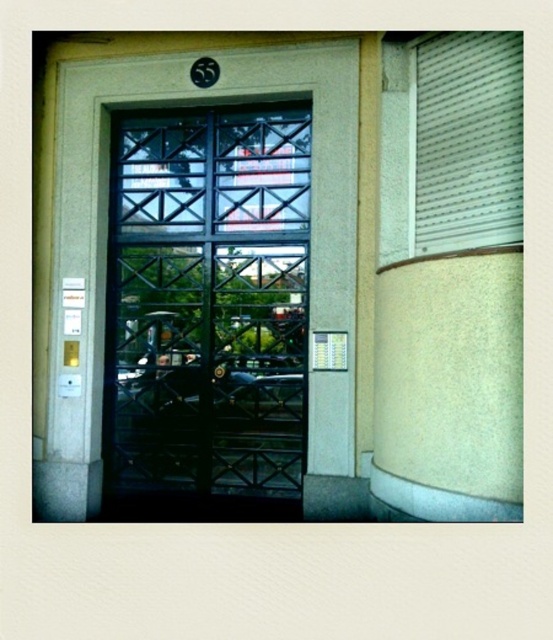
Question: Is black metal/glass door at center thinner than white plastic blinds at right?

Choices:
 (A) yes
 (B) no

Answer: (B)

Question: Which of these objects is positioned closest to the black metal/glass door at center?

Choices:
 (A) beige textured pillar at right
 (B) white plastic blinds at right

Answer: (B)

Question: Which point is farther to the camera?

Choices:
 (A) (452, 161)
 (B) (509, 234)
 (C) (233, 337)

Answer: (C)

Question: Does black metal/glass door at center have a smaller size compared to white plastic blinds at right?

Choices:
 (A) no
 (B) yes

Answer: (A)

Question: Which point is closer to the camera?

Choices:
 (A) beige textured pillar at right
 (B) black metal/glass door at center

Answer: (A)

Question: In this image, where is beige textured pillar at right located relative to white plastic blinds at right?

Choices:
 (A) above
 (B) below

Answer: (B)